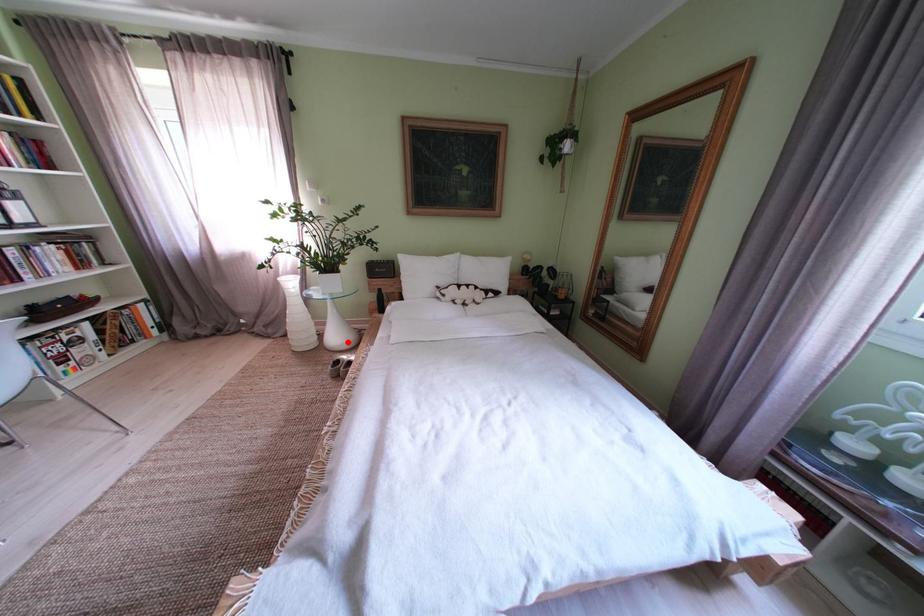
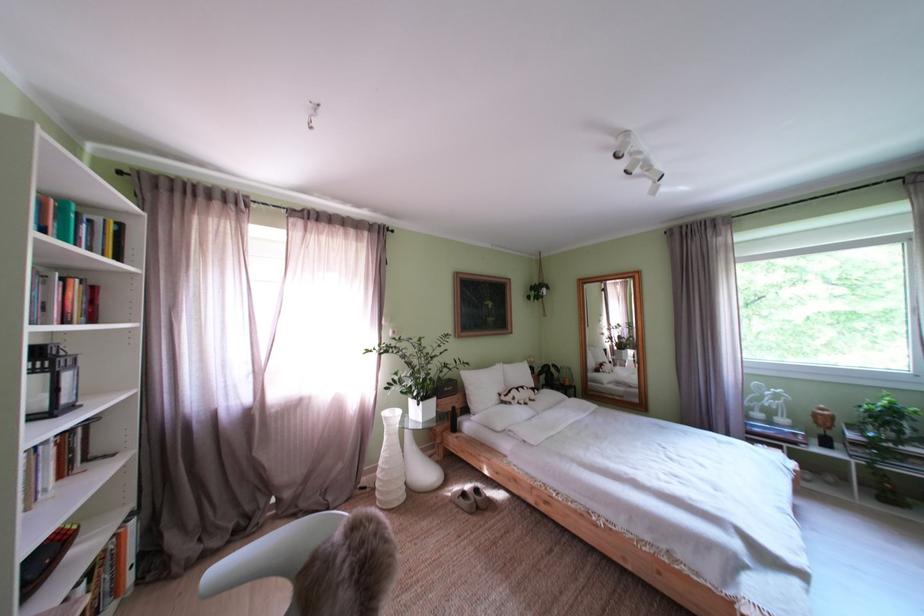
In the second image, find the point that corresponds to the highlighted location in the first image.

(438, 479)